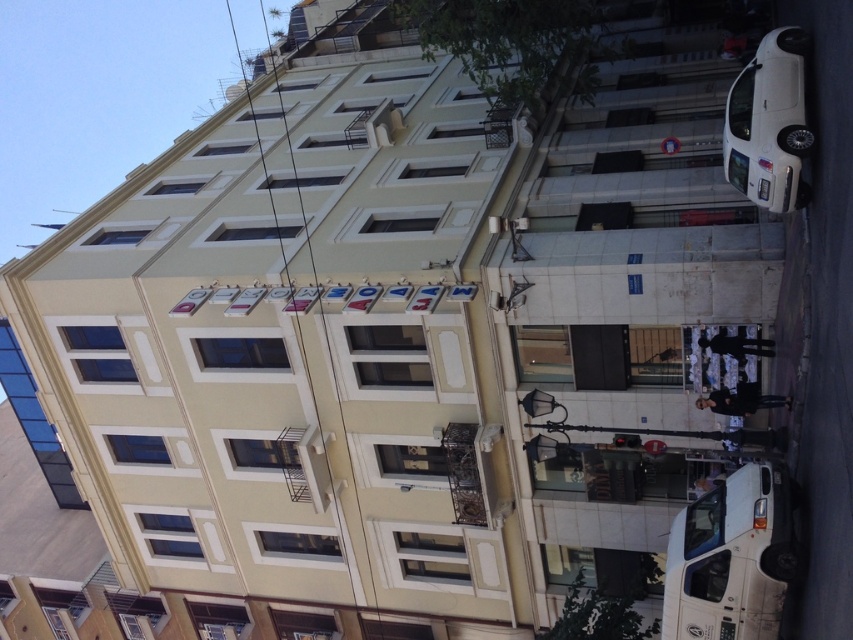
Who is taller, white matte van at lower right or white glossy car at right?

With more height is white matte van at lower right.

Where is `white matte van at lower right`? Image resolution: width=853 pixels, height=640 pixels. white matte van at lower right is located at coordinates (730, 557).

At what (x,y) coordinates should I click in order to perform the action: click on white matte van at lower right. Please return your answer as a coordinate pair (x, y). Image resolution: width=853 pixels, height=640 pixels. Looking at the image, I should click on (730, 557).